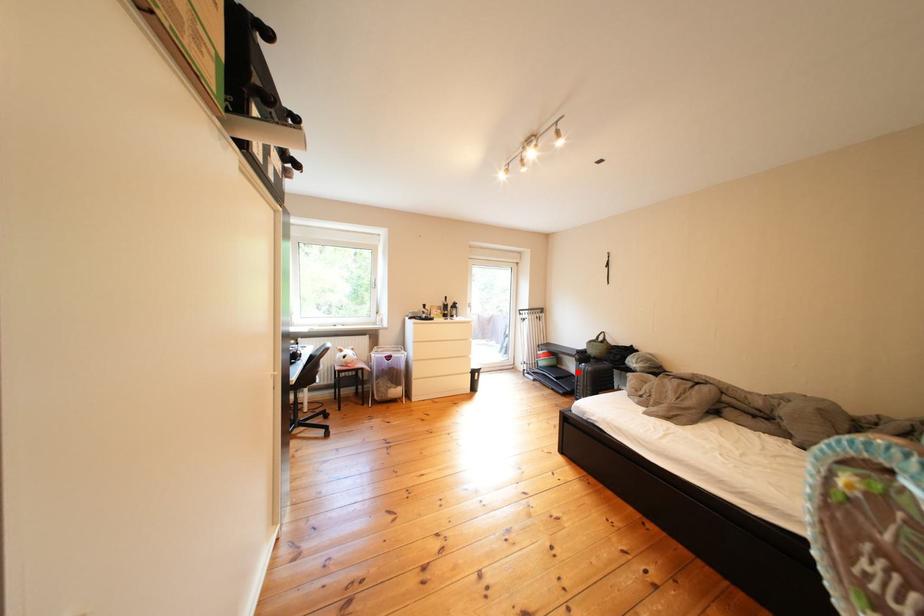
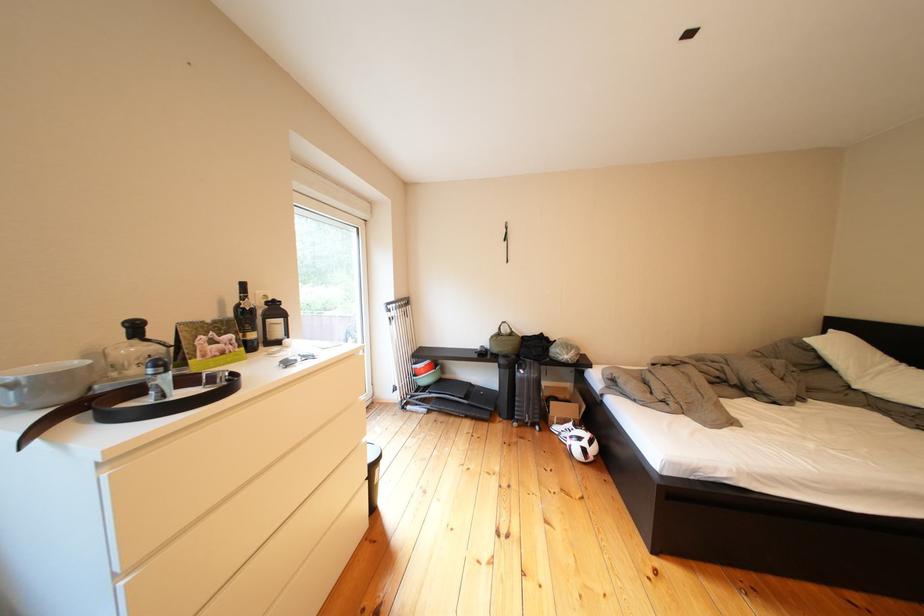
Question: A red point is marked in image1. In image2, is the corresponding 3D point closer to the camera or farther? Reply with the corresponding letter.

Choices:
 (A) The corresponding 3D point is closer.
 (B) The corresponding 3D point is farther.

Answer: (B)